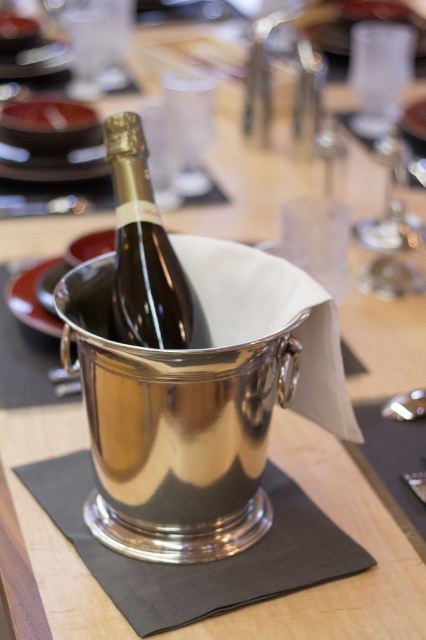
You are a bartender preparing drinks and need to reach for the shiny silver bottle at center and the polished metal spoon at lower right. Which object is closer to your hand if you are standing directly in front of the table?

The polished metal spoon at lower right is closer to your hand because it is located below the shiny silver bottle at center, which is positioned above it.

You are a bartender preparing a drink. You need to choose between the shiny silver bottle at center and the polished metal spoon at lower right to stir a cocktail. Which object should you pick and why?

You should pick the polished metal spoon at lower right because it is the appropriate tool for stirring cocktails, while the shiny silver bottle at center is larger and likely contains the drink itself.

You are at a formal dinner and want to reach for the champagne bottle. There are two points marked on the table. The first point is at coordinate point (135, 236) and the second is at point (403, 410). Which point is closer to you when you are sitting at the table?

Point (135, 236) is in front of point (403, 410), so it is closer to you.